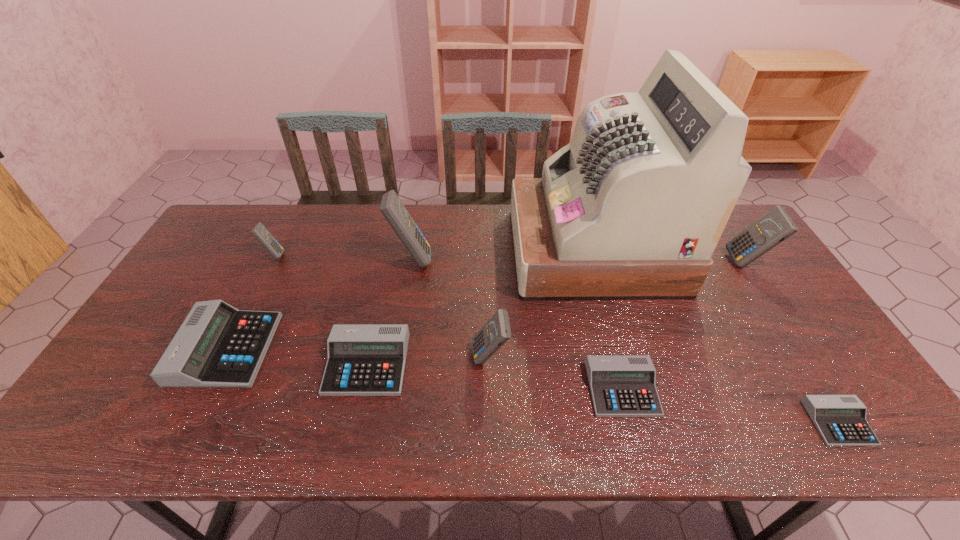
Identify the location of free space located 0.380m on the front-facing side of the biggest blue calculator. The height and width of the screenshot is (540, 960). (552, 259).

At what (x,y) coordinates should I click in order to perform the action: click on free location located on the front-facing side of the seventh shortest calculator. Please return your answer as a coordinate pair (x, y). Image resolution: width=960 pixels, height=540 pixels. Looking at the image, I should click on (697, 262).

Where is `free space located on the front-facing side of the seventh shortest calculator`? free space located on the front-facing side of the seventh shortest calculator is located at coordinates (628, 262).

At what (x,y) coordinates should I click in order to perform the action: click on free space located 0.350m on the front-facing side of the seventh shortest calculator. Please return your answer as a coordinate pair (x, y). The width and height of the screenshot is (960, 540). Looking at the image, I should click on (618, 262).

The height and width of the screenshot is (540, 960). Find the location of `vacant region located 0.380m on the front-facing side of the nearest blue calculator`. vacant region located 0.380m on the front-facing side of the nearest blue calculator is located at coordinates (324, 357).

Identify the location of vacant space located 0.400m on the front-facing side of the nearest blue calculator. Image resolution: width=960 pixels, height=540 pixels. (317, 357).

Where is `vacant area situated on the front-facing side of the nearest blue calculator`? vacant area situated on the front-facing side of the nearest blue calculator is located at coordinates (444, 357).

Where is `free point located on the front-facing side of the leftmost blue calculator`? free point located on the front-facing side of the leftmost blue calculator is located at coordinates (309, 255).

Locate an element on the screen. The image size is (960, 540). vacant point located 0.100m on the front of the leftmost gray calculator is located at coordinates (186, 427).

At what (x,y) coordinates should I click in order to perform the action: click on vacant area situated on the front of the third smallest gray calculator. Please return your answer as a coordinate pair (x, y). Looking at the image, I should click on (354, 423).